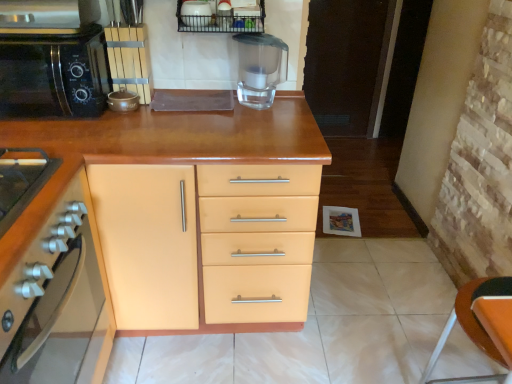
Question: Based on their sizes in the image, would you say matte brown pot at upper left, the first appliance from the bottom, is bigger or smaller than matte orange cabinet at left, the 2th cabinetry viewed from the back?

Choices:
 (A) big
 (B) small

Answer: (B)

Question: In the image, is matte brown pot at upper left, the first appliance from the bottom, on the left side or the right side of matte orange cabinet at left, the 2th cabinetry viewed from the back?

Choices:
 (A) left
 (B) right

Answer: (B)

Question: Estimate the real-world distances between objects in this image. Which object is farther from the matte orange cabinet at left, the 2th cabinetry viewed from the back?

Choices:
 (A) black matte microwave at left
 (B) transparent plastic blender at center
 (C) metallic wire basket at upper center
 (D) matte brown pot at upper left, arranged as the 2th appliance when viewed from the right
 (E) white glossy bowl at upper center, marked as the first appliance in a right-to-left arrangement

Answer: (E)

Question: Which object is positioned farthest from the matte brown pot at upper left, positioned as the 1th appliance in left-to-right order?

Choices:
 (A) transparent plastic blender at center
 (B) white glossy bowl at upper center, positioned as the 1th appliance in top-to-bottom order
 (C) matte orange cabinet at left, which is the 1th cabinetry in front-to-back order
 (D) matte wood cabinet at center, which is the 1th cabinetry in back-to-front order
 (E) metallic wire basket at upper center

Answer: (C)